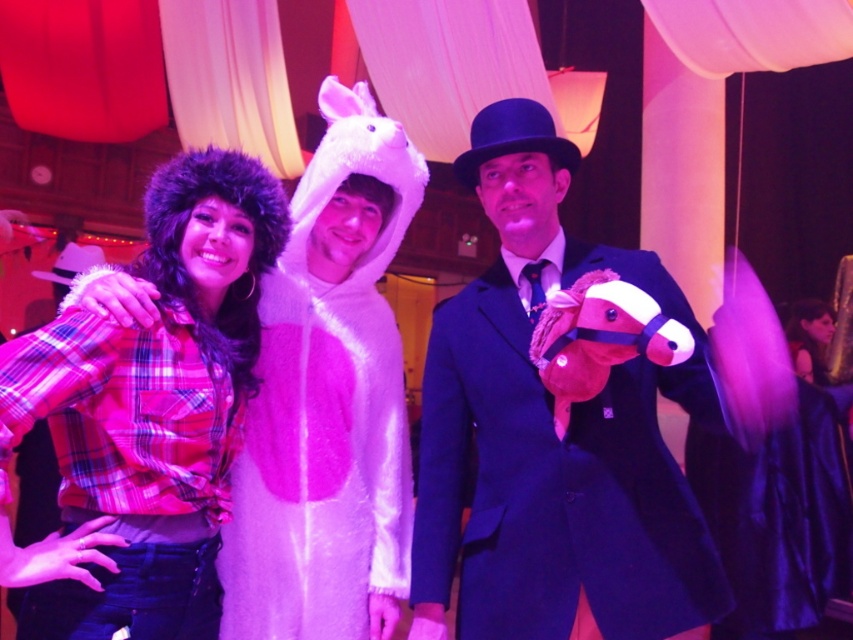
You are a photographer setting up for a group photo. You need to position a small stool for the plaid flannel shirt at left to sit on so they can be at the same height as the velvet blue suit at center. How should you adjust the stool?

The velvet blue suit at center is taller than plaid flannel shirt at left, so you should place the stool so that the plaid flannel shirt at left can stand on it to reach the same height as the velvet blue suit at center.

In the festive scene with warm lighting, there are two people dressed in a velvet blue suit at center and a plaid flannel shirt at left. Which of these two is positioned higher up in the image?

The velvet blue suit at center is positioned higher up in the image because it is located above the plaid flannel shirt at left.